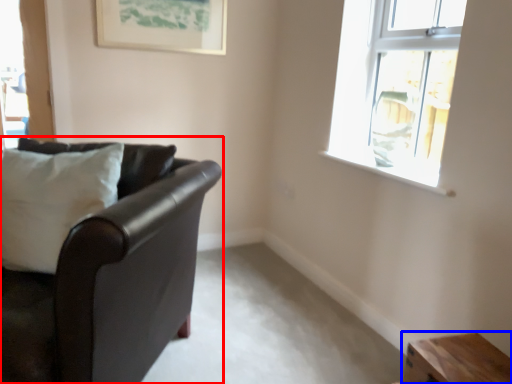
Question: Which object is closer to the camera taking this photo, studio couch (highlighted by a red box) or table (highlighted by a blue box)?

Choices:
 (A) studio couch
 (B) table

Answer: (A)